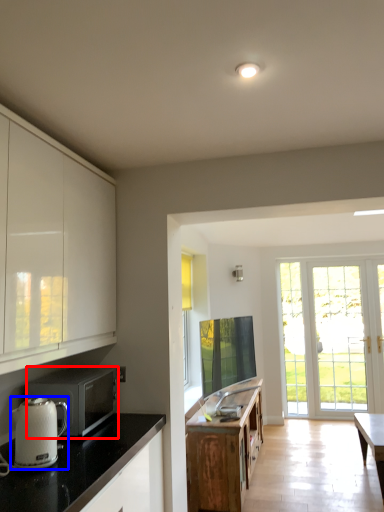
Question: Among these objects, which one is farthest to the camera, microwave oven (highlighted by a red box) or kitchen appliance (highlighted by a blue box)?

Choices:
 (A) microwave oven
 (B) kitchen appliance

Answer: (A)